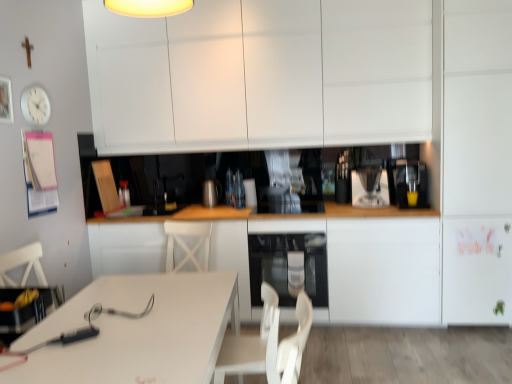
Question: Is sleek metallic coffee maker at center, the 1th appliance when ordered from right to left, inside the boundaries of satin black oven at lower center, or outside?

Choices:
 (A) inside
 (B) outside

Answer: (B)

Question: Looking at their shapes, would you say sleek metallic coffee maker at center, the second appliance positioned from the back, is wider or thinner than satin black oven at lower center?

Choices:
 (A) wide
 (B) thin

Answer: (B)

Question: Which object is the farthest from the satin silver kettle at center, marked as the 2th appliance in a front-to-back arrangement?

Choices:
 (A) yellow matte cup at right
 (B) white matte cabinet at right, arranged as the 2th cabinetry when viewed from the top
 (C) white plastic coffee machine at center
 (D) white plastic swivel chair at lower center
 (E) white matte cabinet at center, marked as the 1th cabinetry in a bottom-to-top arrangement

Answer: (B)

Question: Based on their relative distances, which object is nearer to the satin silver kettle at center, which ranks as the 2th appliance in right-to-left order?

Choices:
 (A) white matte cabinet at right, which is counted as the 2th cabinetry, starting from the bottom
 (B) white matte cabinet at upper center, which is the 1th cabinetry from top to bottom
 (C) white glossy table at lower left
 (D) sleek metallic coffee maker at center, acting as the 2th appliance starting from the left
 (E) white matte cabinet at center, which ranks as the third cabinetry in top-to-bottom order

Answer: (E)